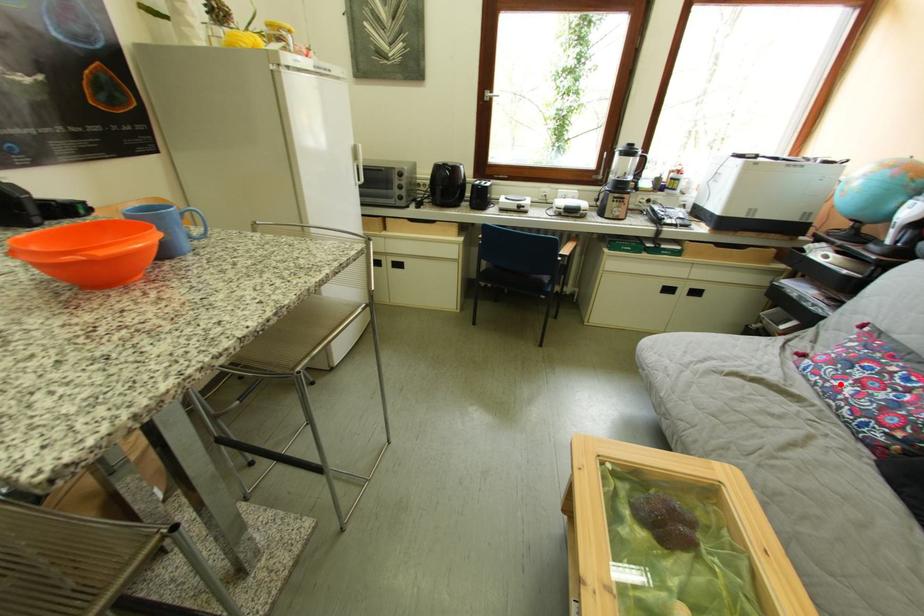
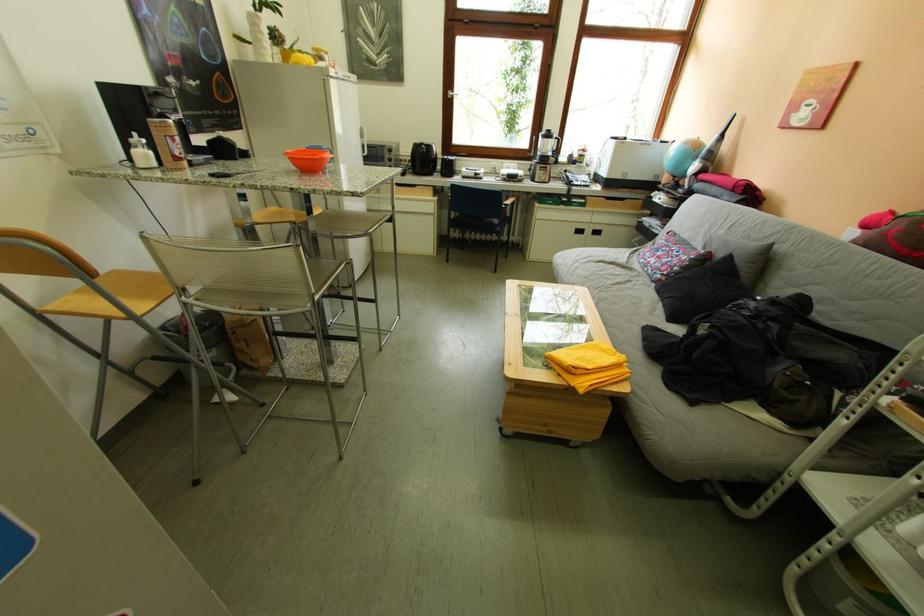
In the second image, find the point that corresponds to the highlighted location in the first image.

(659, 262)